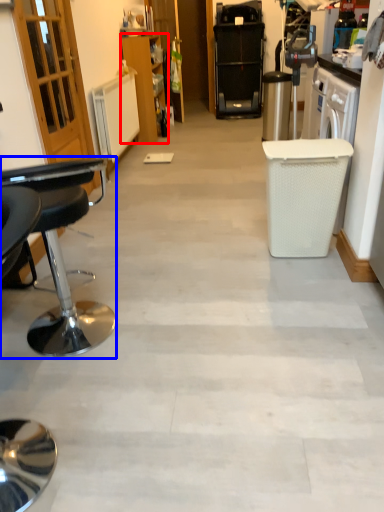
Question: Which point is further to the camera, cabinetry (highlighted by a red box) or chair (highlighted by a blue box)?

Choices:
 (A) cabinetry
 (B) chair

Answer: (A)